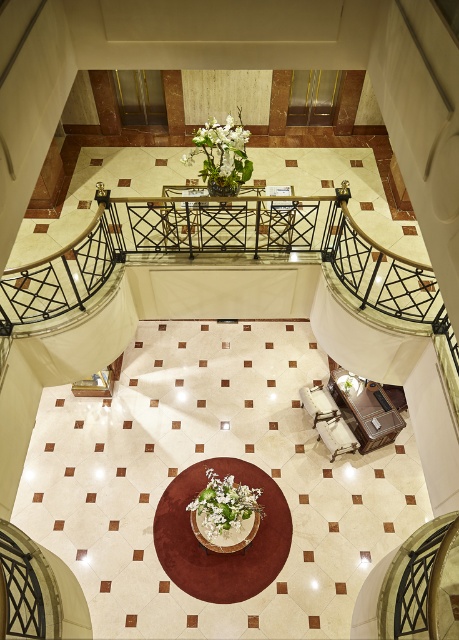
Question: Which of the following is the farthest from the observer?

Choices:
 (A) [223, 353]
 (B) [224, 483]
 (C) [186, 156]

Answer: (A)

Question: Considering the real-world distances, which object is farthest from the white matte vase at center?

Choices:
 (A) white matte flower at center
 (B) white marble atrium at center

Answer: (A)

Question: Is white marble atrium at center to the left of white matte flower at center from the viewer's perspective?

Choices:
 (A) yes
 (B) no

Answer: (B)

Question: Is white marble atrium at center above white matte vase at center?

Choices:
 (A) no
 (B) yes

Answer: (A)

Question: Which point is farther to the camera?

Choices:
 (A) (48, 461)
 (B) (203, 141)

Answer: (A)

Question: Is white matte flower at center to the left of white matte vase at center from the viewer's perspective?

Choices:
 (A) no
 (B) yes

Answer: (B)